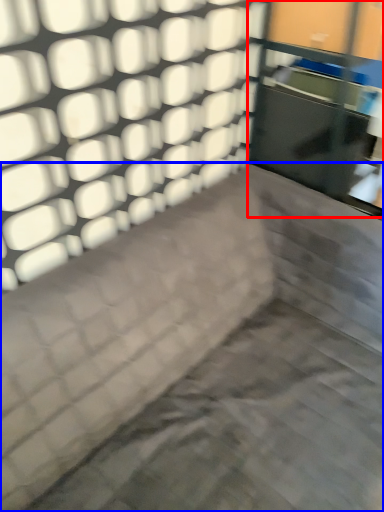
Question: Which object is closer to the camera taking this photo, glass door (highlighted by a red box) or furniture (highlighted by a blue box)?

Choices:
 (A) glass door
 (B) furniture

Answer: (B)